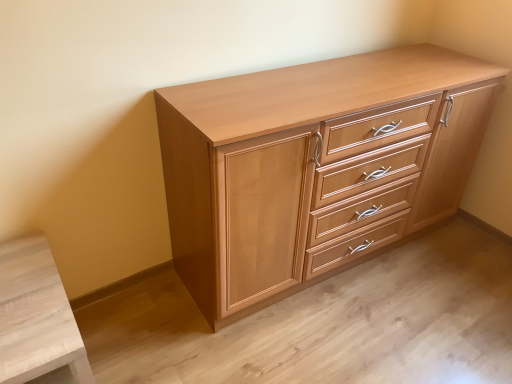
Identify the location of vacant region in front of light brown wood chest of drawers at center. (358, 334).